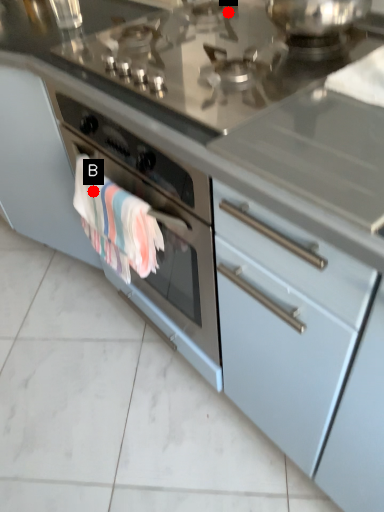
Question: Two points are circled on the image, labeled by A and B beside each circle. Which point is further to the camera?

Choices:
 (A) A is further
 (B) B is further

Answer: (A)